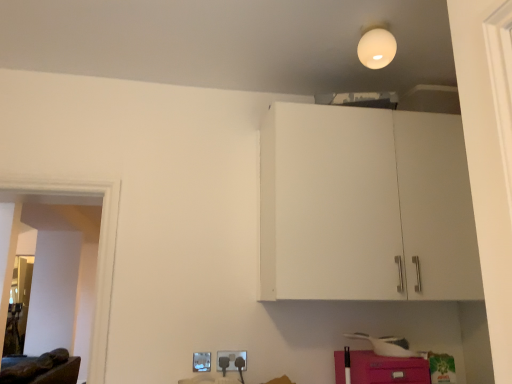
Question: Would you say pink matte cabinet at lower right is a long distance from white matte light bulb at upper center?

Choices:
 (A) no
 (B) yes

Answer: (B)

Question: Is pink matte cabinet at lower right closer to the viewer compared to white matte light bulb at upper center?

Choices:
 (A) no
 (B) yes

Answer: (B)

Question: Could you tell me if pink matte cabinet at lower right is facing white matte light bulb at upper center?

Choices:
 (A) no
 (B) yes

Answer: (A)

Question: Considering the relative sizes of pink matte cabinet at lower right and white matte light bulb at upper center in the image provided, is pink matte cabinet at lower right thinner than white matte light bulb at upper center?

Choices:
 (A) no
 (B) yes

Answer: (A)

Question: Is pink matte cabinet at lower right positioned beyond the bounds of white matte light bulb at upper center?

Choices:
 (A) no
 (B) yes

Answer: (B)

Question: Is pink matte cabinet at lower right bigger than white matte light bulb at upper center?

Choices:
 (A) no
 (B) yes

Answer: (B)

Question: Considering the relative positions of pink matte cabinet at lower right and brown leather couch at lower left in the image provided, is pink matte cabinet at lower right to the right of brown leather couch at lower left from the viewer's perspective?

Choices:
 (A) no
 (B) yes

Answer: (B)

Question: Does pink matte cabinet at lower right have a greater height compared to brown leather couch at lower left?

Choices:
 (A) yes
 (B) no

Answer: (B)

Question: From a real-world perspective, is pink matte cabinet at lower right located beneath brown leather couch at lower left?

Choices:
 (A) yes
 (B) no

Answer: (B)

Question: Considering the relative sizes of pink matte cabinet at lower right and brown leather couch at lower left in the image provided, is pink matte cabinet at lower right thinner than brown leather couch at lower left?

Choices:
 (A) no
 (B) yes

Answer: (B)

Question: Does pink matte cabinet at lower right have a lesser height compared to brown leather couch at lower left?

Choices:
 (A) no
 (B) yes

Answer: (B)

Question: Does pink matte cabinet at lower right have a larger size compared to brown leather couch at lower left?

Choices:
 (A) no
 (B) yes

Answer: (A)

Question: Considering the relative sizes of matte plastic electric outlet at lower center, which appears as the 1th electric outlet when viewed from the right, and brown leather couch at lower left in the image provided, is matte plastic electric outlet at lower center, which appears as the 1th electric outlet when viewed from the right, shorter than brown leather couch at lower left?

Choices:
 (A) no
 (B) yes

Answer: (B)